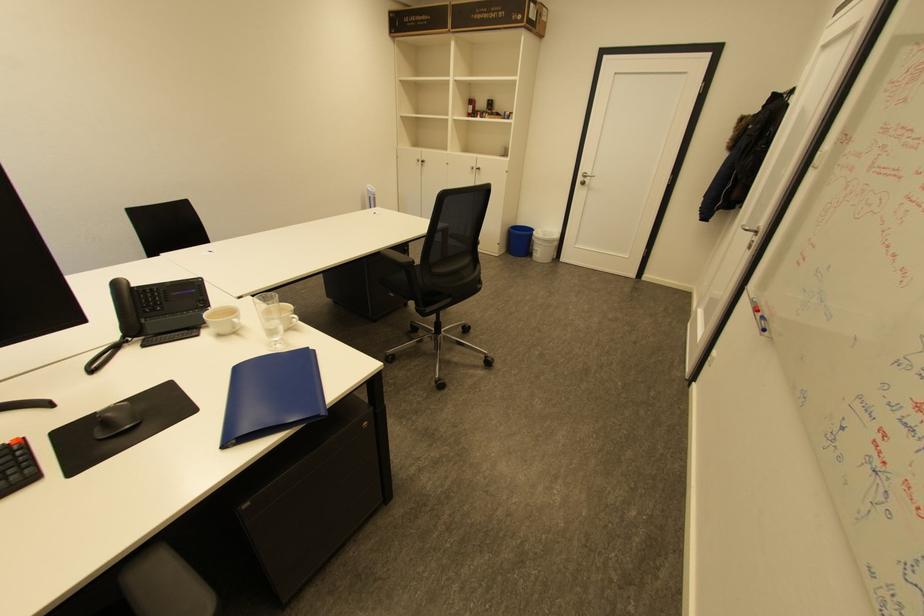
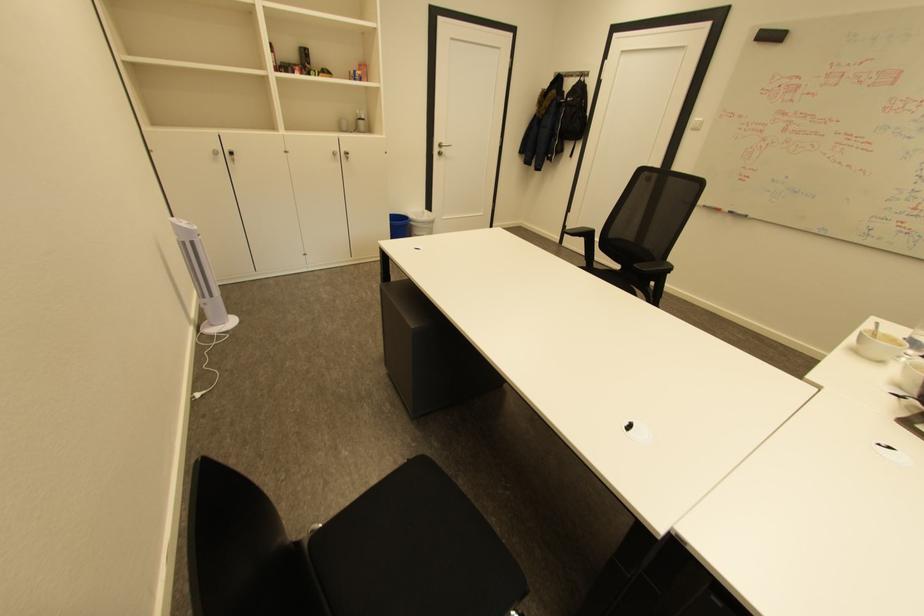
In the second image, find the point that corresponds to pixel 545 244 in the first image.

(432, 227)